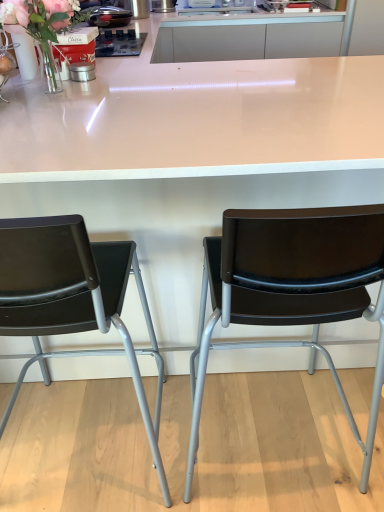
This screenshot has width=384, height=512. I want to click on free space in front of translucent glass vase at upper left, so click(x=50, y=104).